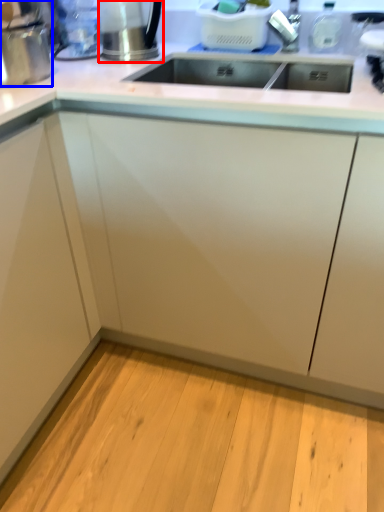
Question: Which point is further to the camera, appliance (highlighted by a red box) or appliance (highlighted by a blue box)?

Choices:
 (A) appliance
 (B) appliance

Answer: (A)